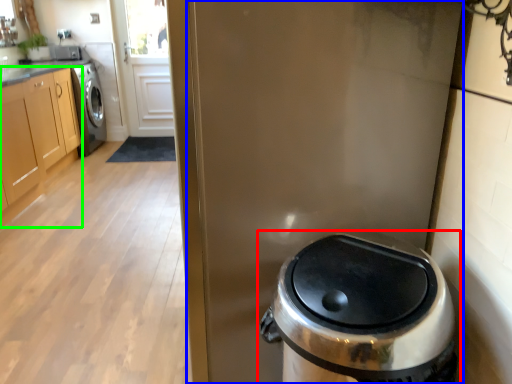
Question: Considering the real-world distances, which object is farthest from waste container (highlighted by a red box)? screen door (highlighted by a blue box) or cabinetry (highlighted by a green box)?

Choices:
 (A) screen door
 (B) cabinetry

Answer: (B)